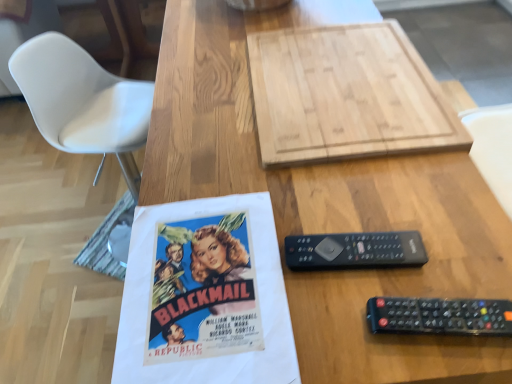
The height and width of the screenshot is (384, 512). Describe the element at coordinates (346, 94) in the screenshot. I see `natural wood cutting board at upper center` at that location.

Find the location of `black plastic remote at lower right`. black plastic remote at lower right is located at coordinates (440, 316).

Describe the element at coordinates (440, 316) in the screenshot. I see `black plastic remote at lower right` at that location.

Where is `natural wood cutting board at upper center`? This screenshot has height=384, width=512. natural wood cutting board at upper center is located at coordinates (346, 94).

Who is taller, black plastic remote at lower right or black plastic remote at right?

black plastic remote at lower right is taller.

Measure the distance from black plastic remote at lower right to black plastic remote at right.

3.33 inches.

From a real-world perspective, is black plastic remote at lower right under black plastic remote at right?

Actually, black plastic remote at lower right is physically above black plastic remote at right in the real world.

Identify the location of control lying on the left of black plastic remote at lower right. This screenshot has height=384, width=512. (355, 250).

Is black plastic remote at right positioned with its back to black plastic remote at lower right?

black plastic remote at right is not turned away from black plastic remote at lower right.

Which is behind, black plastic remote at right or black plastic remote at lower right?

black plastic remote at right is behind.

At what (x,y) coordinates should I click in order to perform the action: click on control above the black plastic remote at lower right (from the image's perspective). Please return your answer as a coordinate pair (x, y). Looking at the image, I should click on tap(355, 250).

From the image's perspective, between black plastic remote at right and black plastic remote at lower right, which one is located above?

black plastic remote at right appears higher in the image.

Does black plastic remote at right have a larger size compared to natural wood cutting board at upper center?

No, black plastic remote at right is not bigger than natural wood cutting board at upper center.

You are a GUI agent. You are given a task and a screenshot of the screen. Output one action in this format:
    pyautogui.click(x=<x>, y=<y>)
    Task: Click on the control on the left of natural wood cutting board at upper center
    
    Given the screenshot: What is the action you would take?
    pyautogui.click(x=355, y=250)

Is black plastic remote at right inside the boundaries of natural wood cutting board at upper center, or outside?

black plastic remote at right is located beyond the bounds of natural wood cutting board at upper center.

Does black plastic remote at right lie in front of natural wood cutting board at upper center?

Yes, black plastic remote at right is in front of natural wood cutting board at upper center.

Locate an element on the screen. This screenshot has height=384, width=512. remote control above the natural wood cutting board at upper center (from a real-world perspective) is located at coordinates (440, 316).

Who is bigger, natural wood cutting board at upper center or black plastic remote at lower right?

With larger size is natural wood cutting board at upper center.

Is natural wood cutting board at upper center far away from black plastic remote at lower right?

natural wood cutting board at upper center is near black plastic remote at lower right, not far away.

Consider the image. Is natural wood cutting board at upper center inside or outside of black plastic remote at lower right?

natural wood cutting board at upper center is located beyond the bounds of black plastic remote at lower right.

This screenshot has height=384, width=512. In order to click on cardboard below the black plastic remote at lower right (from a real-world perspective) in this screenshot , I will do `click(346, 94)`.

Is black plastic remote at lower right looking in the opposite direction of natural wood cutting board at upper center?

Correct, black plastic remote at lower right is looking away from natural wood cutting board at upper center.

Is black plastic remote at lower right far from natural wood cutting board at upper center?

No, black plastic remote at lower right is not far from natural wood cutting board at upper center.

Measure the distance from black plastic remote at lower right to natural wood cutting board at upper center.

A distance of 46.55 centimeters exists between black plastic remote at lower right and natural wood cutting board at upper center.

Based on the photo, could you tell me if natural wood cutting board at upper center is turned towards black plastic remote at right?

No, natural wood cutting board at upper center is not turned towards black plastic remote at right.

Find the location of a particular element. This screenshot has height=384, width=512. control in front of the natural wood cutting board at upper center is located at coordinates (355, 250).

Which of these two, natural wood cutting board at upper center or black plastic remote at right, is wider?

natural wood cutting board at upper center.

Between point (336, 110) and point (387, 238), which one is positioned in front?

The point (387, 238) is in front.

Locate an element on the screen. The image size is (512, 384). remote control lying on the right of black plastic remote at right is located at coordinates (440, 316).

This screenshot has width=512, height=384. In order to click on control that is behind the black plastic remote at lower right in this screenshot , I will do `click(355, 250)`.

From the image, which object appears to be nearer to natural wood cutting board at upper center, black plastic remote at right or black plastic remote at lower right?

black plastic remote at right is positioned closer to the anchor natural wood cutting board at upper center.

Looking at the image, which one is located closer to black plastic remote at right, natural wood cutting board at upper center or black plastic remote at lower right?

black plastic remote at lower right is closer to black plastic remote at right.

Based on their spatial positions, is black plastic remote at lower right or black plastic remote at right further from natural wood cutting board at upper center?

Among the two, black plastic remote at lower right is located further to natural wood cutting board at upper center.

When comparing their distances from black plastic remote at right, does black plastic remote at lower right or natural wood cutting board at upper center seem further?

Among the two, natural wood cutting board at upper center is located further to black plastic remote at right.

Estimate the real-world distances between objects in this image. Which object is further from black plastic remote at lower right, natural wood cutting board at upper center or black plastic remote at right?

Among the two, natural wood cutting board at upper center is located further to black plastic remote at lower right.

Which object lies nearer to the anchor point black plastic remote at lower right, black plastic remote at right or natural wood cutting board at upper center?

black plastic remote at right is positioned closer to the anchor black plastic remote at lower right.

Where is `control between natural wood cutting board at upper center and black plastic remote at lower right from top to bottom`? control between natural wood cutting board at upper center and black plastic remote at lower right from top to bottom is located at coordinates (355, 250).